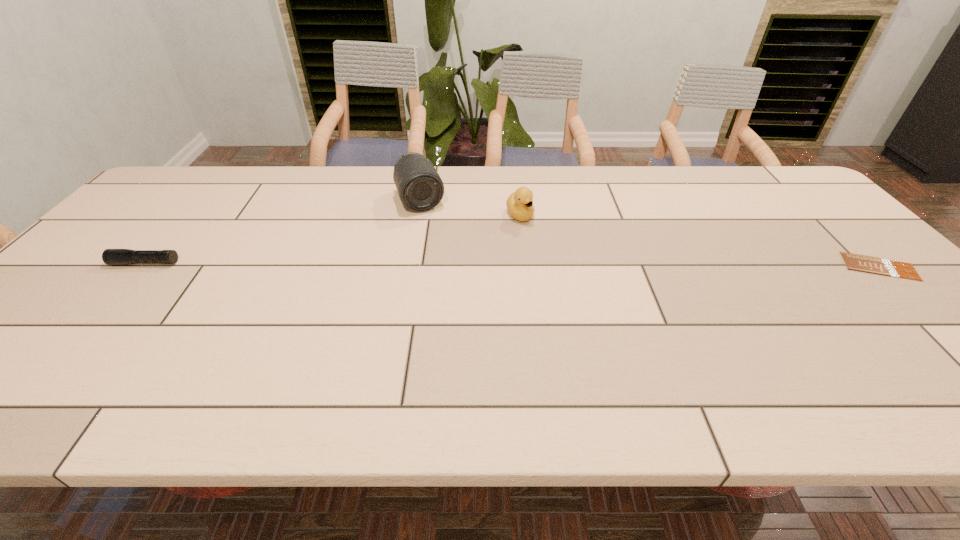
Where is `vacant spot on the desktop that is between the leftmost object and the chocolate bar and is positioned on the surface of the telephoto lens`? vacant spot on the desktop that is between the leftmost object and the chocolate bar and is positioned on the surface of the telephoto lens is located at coordinates (448, 265).

Identify the location of free space on the desktop that is between the leftmost object and the chocolate bar and is positioned on the face of the third shortest object. This screenshot has width=960, height=540. (561, 265).